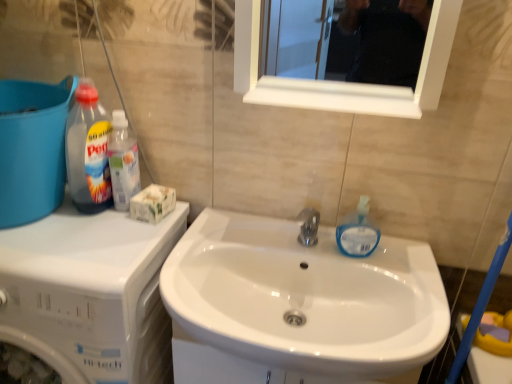
Find the location of a particular element. This screenshot has width=512, height=384. vacant space to the right of translucent blue liquid soap at sink right, the 1th cleaning product positioned from the right is located at coordinates (406, 260).